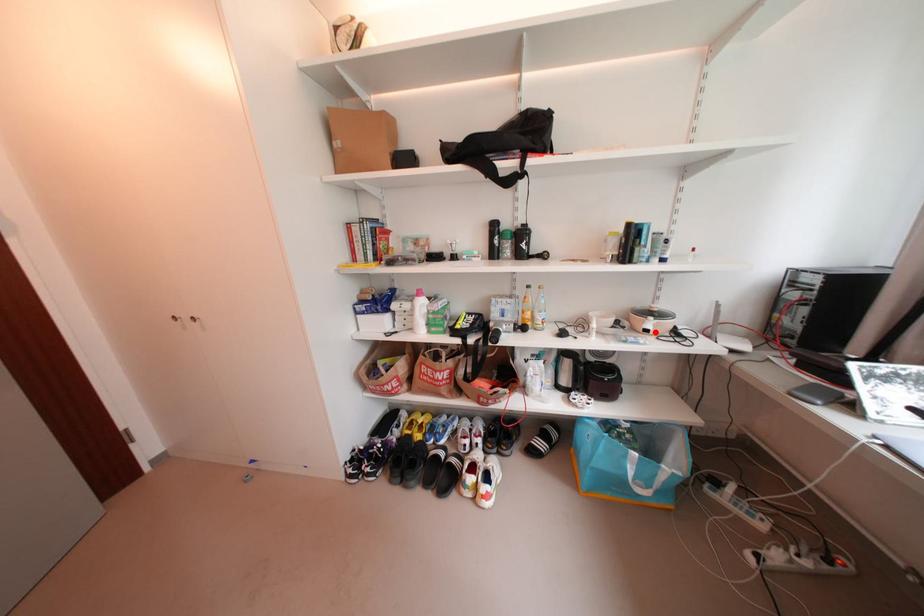
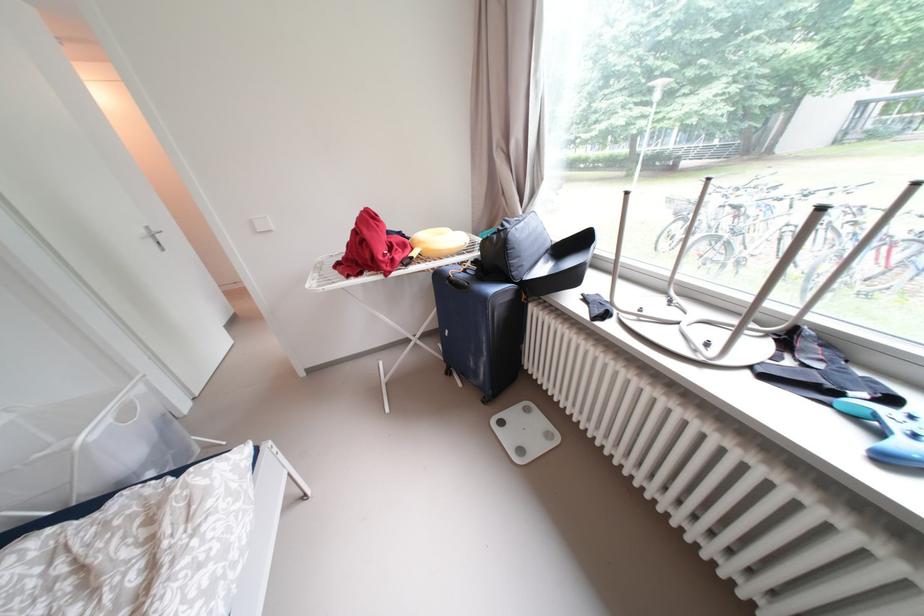
Question: I am providing you with two images of the same scene from different viewpoints. A red point is marked on the first image. At the location where the point appears in image 1, is it still visible in image 2?

Choices:
 (A) Yes
 (B) No

Answer: (B)